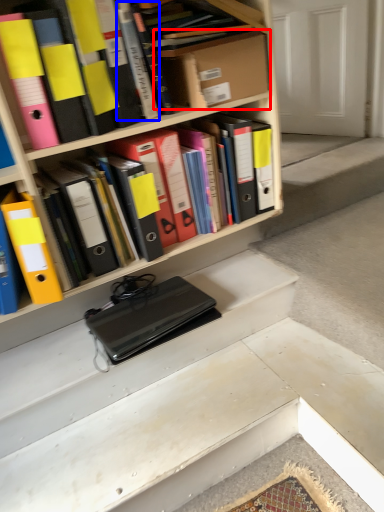
Question: Which point is closer to the camera, cardboard box (highlighted by a red box) or book (highlighted by a blue box)?

Choices:
 (A) cardboard box
 (B) book

Answer: (B)